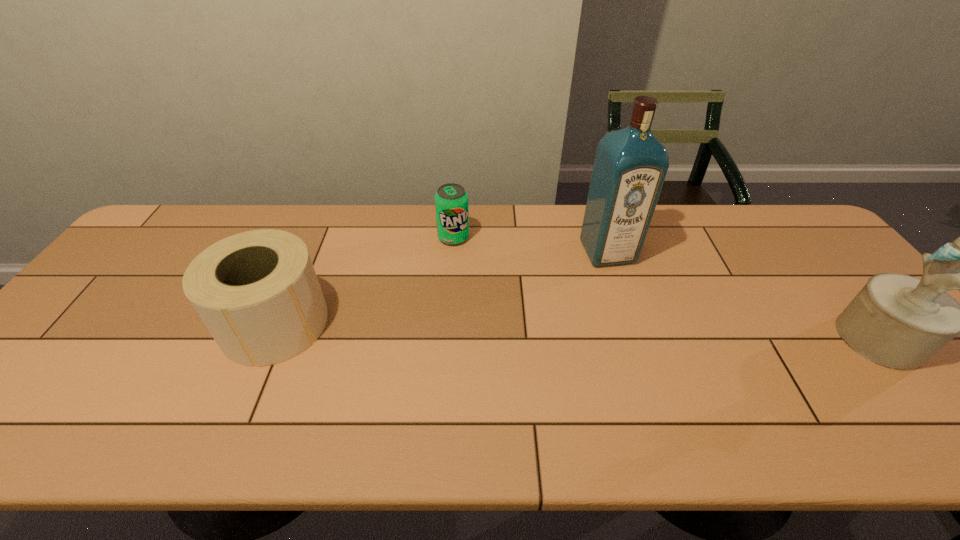
I want to click on free space located at the beak of the rightmost object, so click(x=696, y=339).

This screenshot has width=960, height=540. I want to click on vacant region located at the beak of the rightmost object, so click(765, 339).

Image resolution: width=960 pixels, height=540 pixels. Identify the location of free region located 0.220m on the flat label side of the liquor. pos(648,328).

Image resolution: width=960 pixels, height=540 pixels. In order to click on blank space located on the flat label side of the liquor in this screenshot , I will do `click(672, 374)`.

You are a GUI agent. You are given a task and a screenshot of the screen. Output one action in this format:
    pyautogui.click(x=<x>, y=<y>)
    Task: Click on the vacant area located on the flat label side of the liquor
    This screenshot has width=960, height=540.
    Given the screenshot: What is the action you would take?
    pyautogui.click(x=670, y=371)

At what (x,y) coordinates should I click in order to perform the action: click on vacant space situated on the front-facing side of the shortest object. Please return your answer as a coordinate pair (x, y). The height and width of the screenshot is (540, 960). Looking at the image, I should click on (467, 256).

This screenshot has height=540, width=960. Find the location of `vacant space located 0.130m on the front-facing side of the shortest object`. vacant space located 0.130m on the front-facing side of the shortest object is located at coordinates (478, 273).

At what (x,y) coordinates should I click in order to perform the action: click on free space located on the front-facing side of the shortest object. Please return your answer as a coordinate pair (x, y). This screenshot has width=960, height=540. Looking at the image, I should click on (487, 284).

Where is `liquor present at the far edge`? liquor present at the far edge is located at coordinates (630, 166).

What are the coordinates of `pop soda located at the far edge` in the screenshot? It's located at (451, 201).